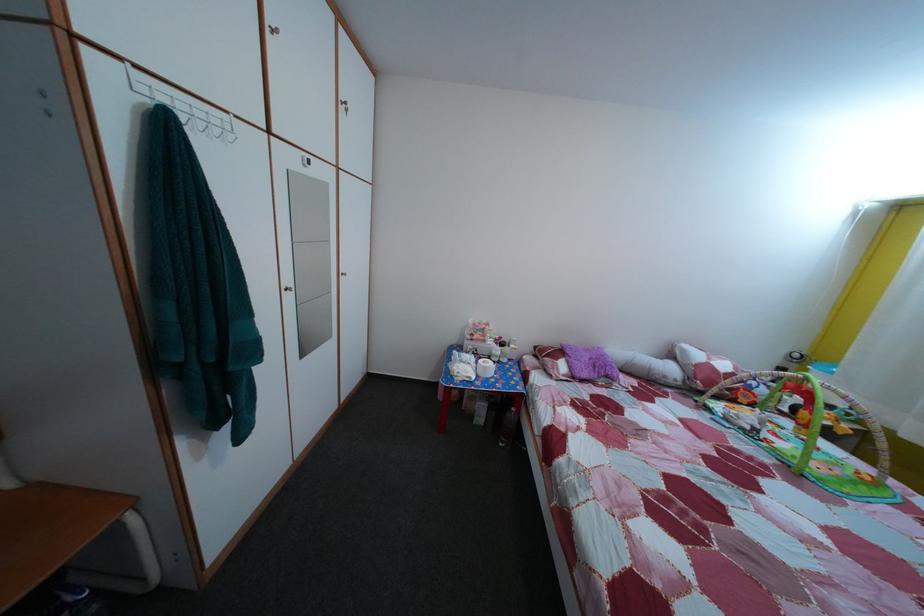
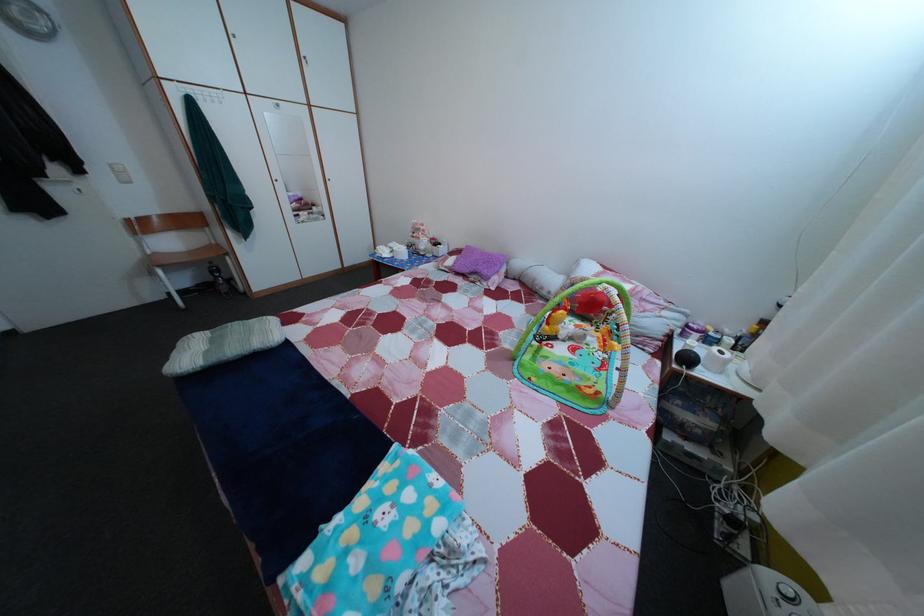
Find the pixel in the second image that matches pixel 597 358 in the first image.

(492, 261)